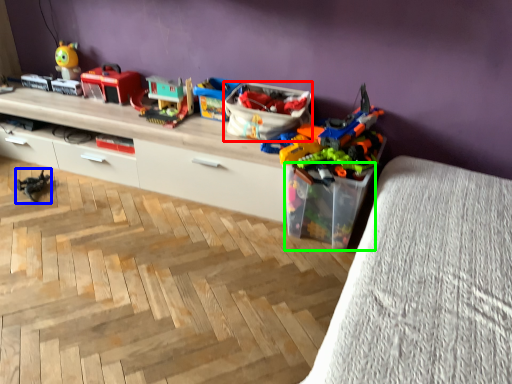
Question: Based on their relative distances, which object is nearer to storage box (highlighted by a red box)? Choose from toy (highlighted by a blue box) and storage box (highlighted by a green box).

Choices:
 (A) toy
 (B) storage box

Answer: (B)